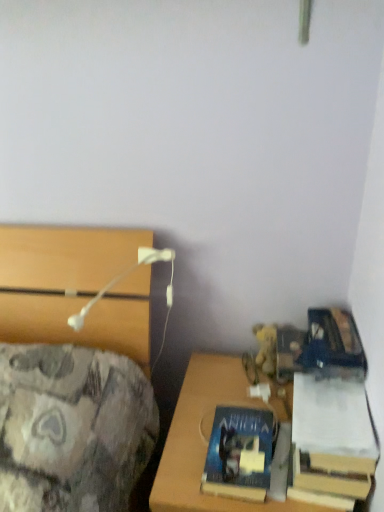
Question: From the image's perspective, does hardcover book at lower right, placed as the first book when sorted from right to left, appear lower than wooden desk at lower right?

Choices:
 (A) no
 (B) yes

Answer: (A)

Question: From the image's perspective, is hardcover book at lower right, placed as the first book when sorted from right to left, on top of wooden desk at lower right?

Choices:
 (A) yes
 (B) no

Answer: (A)

Question: From a real-world perspective, is hardcover book at lower right, which is the 2th book from left to right, located beneath wooden desk at lower right?

Choices:
 (A) yes
 (B) no

Answer: (B)

Question: Does hardcover book at lower right, which is the 2th book from left to right, appear on the right side of wooden desk at lower right?

Choices:
 (A) yes
 (B) no

Answer: (A)

Question: Is hardcover book at lower right, which is the 2th book from left to right, oriented away from wooden desk at lower right?

Choices:
 (A) yes
 (B) no

Answer: (B)

Question: Can you confirm if hardcover book at lower right, placed as the first book when sorted from right to left, is shorter than wooden desk at lower right?

Choices:
 (A) yes
 (B) no

Answer: (A)

Question: Does blue matte book at lower right, which ranks as the 2th book in right-to-left order, lie behind hardcover book at lower right, which is the 2th book from left to right?

Choices:
 (A) no
 (B) yes

Answer: (B)

Question: From the image's perspective, is blue matte book at lower right, the 1th book when ordered from left to right, under hardcover book at lower right, placed as the first book when sorted from right to left?

Choices:
 (A) no
 (B) yes

Answer: (B)

Question: From a real-world perspective, is blue matte book at lower right, which ranks as the 2th book in right-to-left order, beneath hardcover book at lower right, which is the 2th book from left to right?

Choices:
 (A) no
 (B) yes

Answer: (B)

Question: Are blue matte book at lower right, the 1th book when ordered from left to right, and hardcover book at lower right, which is the 2th book from left to right, making contact?

Choices:
 (A) no
 (B) yes

Answer: (A)

Question: Is blue matte book at lower right, the 1th book when ordered from left to right, located outside hardcover book at lower right, which is the 2th book from left to right?

Choices:
 (A) yes
 (B) no

Answer: (A)

Question: From a real-world perspective, is blue matte book at lower right, which ranks as the 2th book in right-to-left order, positioned over hardcover book at lower right, placed as the first book when sorted from right to left, based on gravity?

Choices:
 (A) no
 (B) yes

Answer: (A)

Question: Is blue matte book at lower right, the 1th book when ordered from left to right, aimed at yellow plush at right?

Choices:
 (A) no
 (B) yes

Answer: (A)